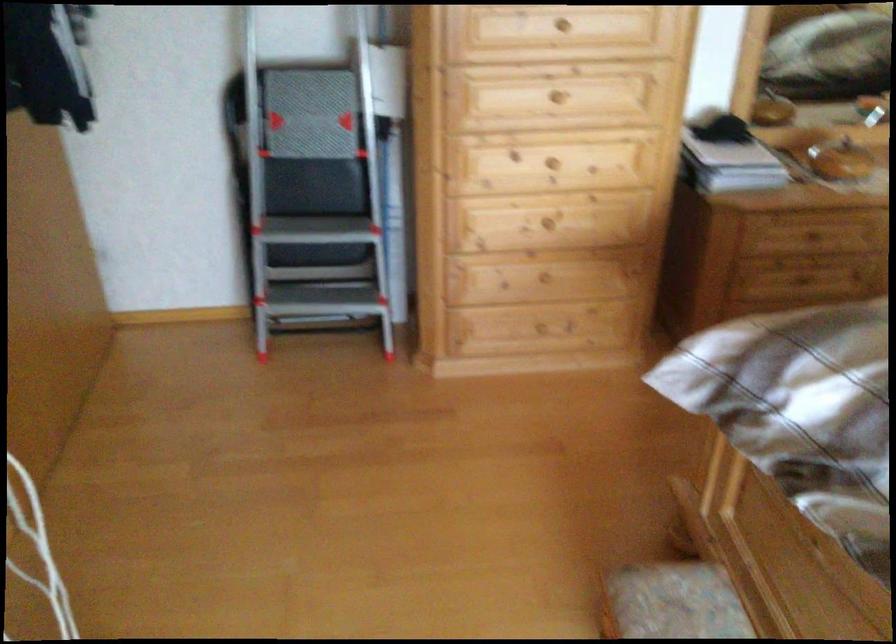
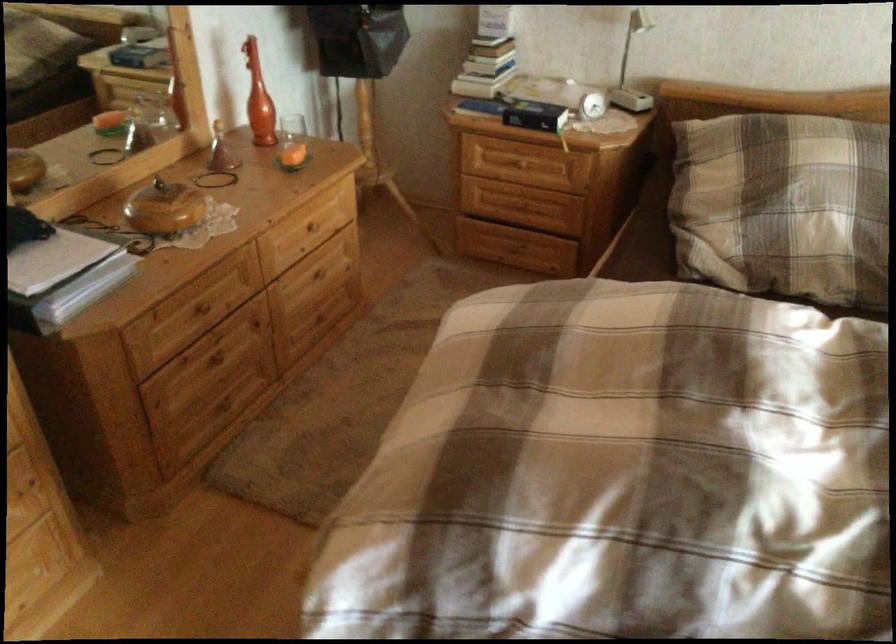
The point at (736, 144) is marked in the first image. Where is the corresponding point in the second image?

(55, 260)